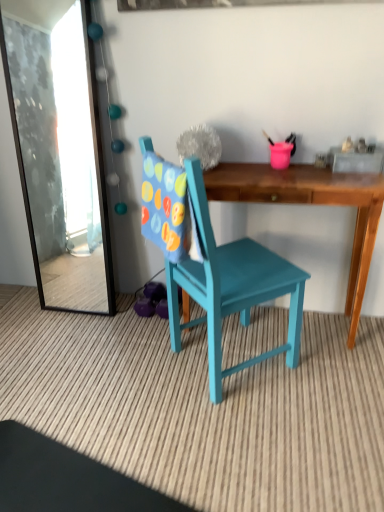
Locate an element on the screen. Image resolution: width=384 pixels, height=512 pixels. free spot below wooden desk at center (from a real-world perspective) is located at coordinates (310, 325).